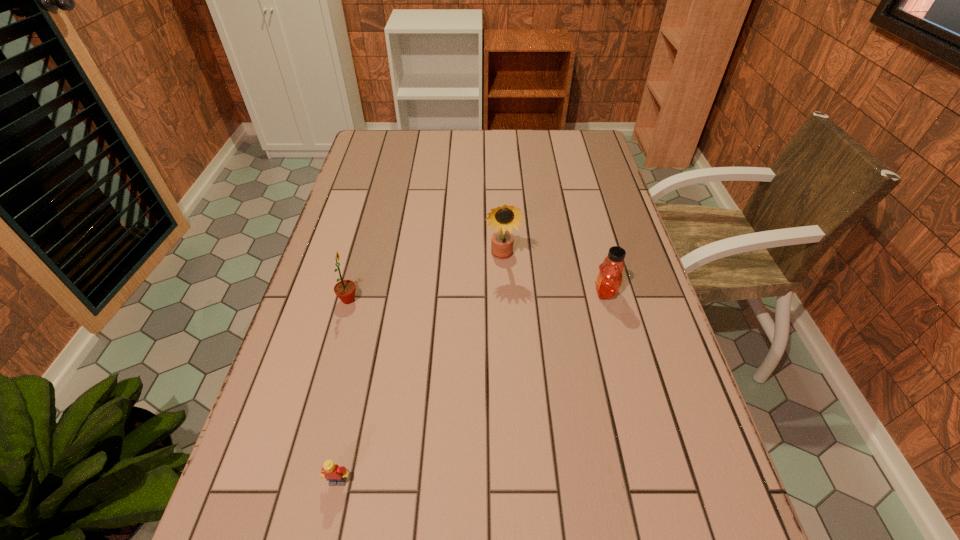
The image size is (960, 540). Identify the location of vacant area that lies between the leftmost object and the nearest object. [x=344, y=390].

Where is `vacant region between the Lego and the third object from left to right`? The height and width of the screenshot is (540, 960). vacant region between the Lego and the third object from left to right is located at coordinates (420, 368).

Identify the location of vacant point located between the second object from left to right and the honey. (471, 387).

This screenshot has width=960, height=540. I want to click on vacant point located between the farthest object and the third tallest object, so click(554, 274).

You are a GUI agent. You are given a task and a screenshot of the screen. Output one action in this format:
    pyautogui.click(x=<x>, y=<y>)
    Task: Click on the vacant area that lies between the leftmost object and the third object from right to left
    
    Given the screenshot: What is the action you would take?
    pyautogui.click(x=344, y=390)

At what (x,y) coordinates should I click in order to perform the action: click on vacant space that's between the leftmost object and the Lego. Please return your answer as a coordinate pair (x, y). Looking at the image, I should click on (344, 390).

This screenshot has width=960, height=540. In order to click on vacant area that lies between the third object from left to right and the rightmost object in this screenshot , I will do `click(554, 274)`.

The image size is (960, 540). I want to click on free spot between the shortest object and the third tallest object, so click(x=471, y=387).

The height and width of the screenshot is (540, 960). Identify the location of vacant space that is in between the honey and the tallest object. (554, 274).

Locate an element on the screen. unoccupied position between the farthest object and the nearest object is located at coordinates (420, 368).